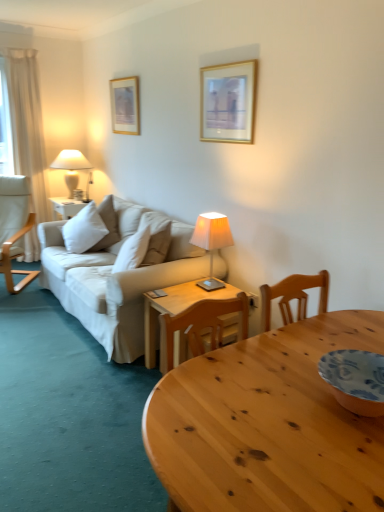
Question: Is wooden table at center to the right of gold-framed picture at upper left, placed as the first picture frame when sorted from left to right, from the viewer's perspective?

Choices:
 (A) no
 (B) yes

Answer: (B)

Question: Is wooden table at center smaller than gold-framed picture at upper left, which appears as the 2th picture frame when viewed from the right?

Choices:
 (A) yes
 (B) no

Answer: (B)

Question: Is the position of wooden table at center less distant than that of gold-framed picture at upper left, placed as the first picture frame when sorted from left to right?

Choices:
 (A) no
 (B) yes

Answer: (B)

Question: Is wooden table at center beside gold-framed picture at upper left, placed as the first picture frame when sorted from left to right?

Choices:
 (A) no
 (B) yes

Answer: (A)

Question: Is wooden table at center outside of gold-framed picture at upper left, which ranks as the first picture frame in back-to-front order?

Choices:
 (A) no
 (B) yes

Answer: (B)

Question: Is white soft cushion at center bigger or smaller than ivory fabric lampshade at center, marked as the first lamp in a front-to-back arrangement?

Choices:
 (A) small
 (B) big

Answer: (B)

Question: From a real-world perspective, is white soft cushion at center above or below ivory fabric lampshade at center, placed as the first lamp when sorted from bottom to top?

Choices:
 (A) below
 (B) above

Answer: (A)

Question: Is white soft cushion at center in front of or behind ivory fabric lampshade at center, placed as the first lamp when sorted from bottom to top, in the image?

Choices:
 (A) behind
 (B) front

Answer: (A)

Question: Is point (79, 238) positioned closer to the camera than point (208, 248)?

Choices:
 (A) closer
 (B) farther

Answer: (B)

Question: Which is correct: gold-framed picture at upper center, which is the 1th picture frame in right-to-left order, is inside white soft cushion at center, or outside of it?

Choices:
 (A) inside
 (B) outside

Answer: (B)

Question: From a real-world perspective, is gold-framed picture at upper center, the 2th picture frame positioned from the back, above or below white soft cushion at center?

Choices:
 (A) below
 (B) above

Answer: (B)

Question: Is gold-framed picture at upper center, the 2th picture frame positioned from the back, taller or shorter than white soft cushion at center?

Choices:
 (A) tall
 (B) short

Answer: (A)

Question: From the image's perspective, is gold-framed picture at upper center, which is the 2th picture frame from left to right, above or below white soft cushion at center?

Choices:
 (A) below
 (B) above

Answer: (B)

Question: From a real-world perspective, relative to gold-framed picture at upper left, which is counted as the second picture frame, starting from the front, is ivory fabric lampshade at center, positioned as the first lamp in right-to-left order, vertically above or below?

Choices:
 (A) above
 (B) below

Answer: (B)

Question: Is ivory fabric lampshade at center, which is counted as the 2th lamp, starting from the left, situated inside gold-framed picture at upper left, which is counted as the second picture frame, starting from the front, or outside?

Choices:
 (A) inside
 (B) outside

Answer: (B)